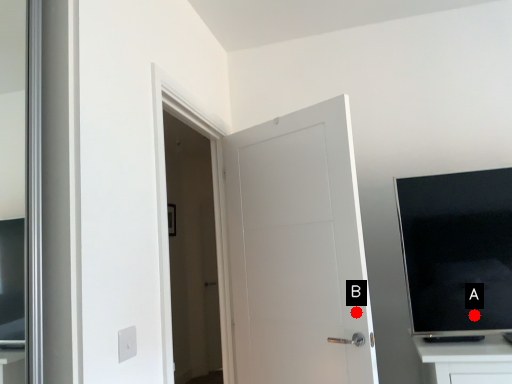
Question: Two points are circled on the image, labeled by A and B beside each circle. Which point is closer to the camera?

Choices:
 (A) A is closer
 (B) B is closer

Answer: (A)